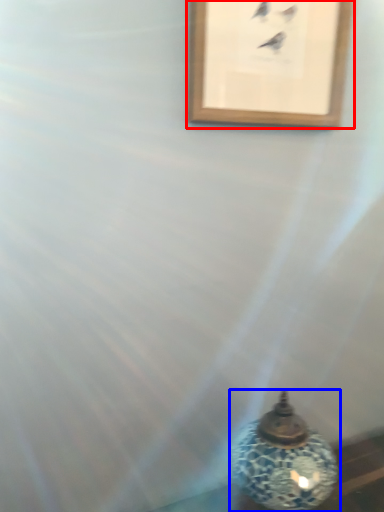
Question: Which point is further to the camera, picture frame (highlighted by a red box) or oil lamp (highlighted by a blue box)?

Choices:
 (A) picture frame
 (B) oil lamp

Answer: (A)